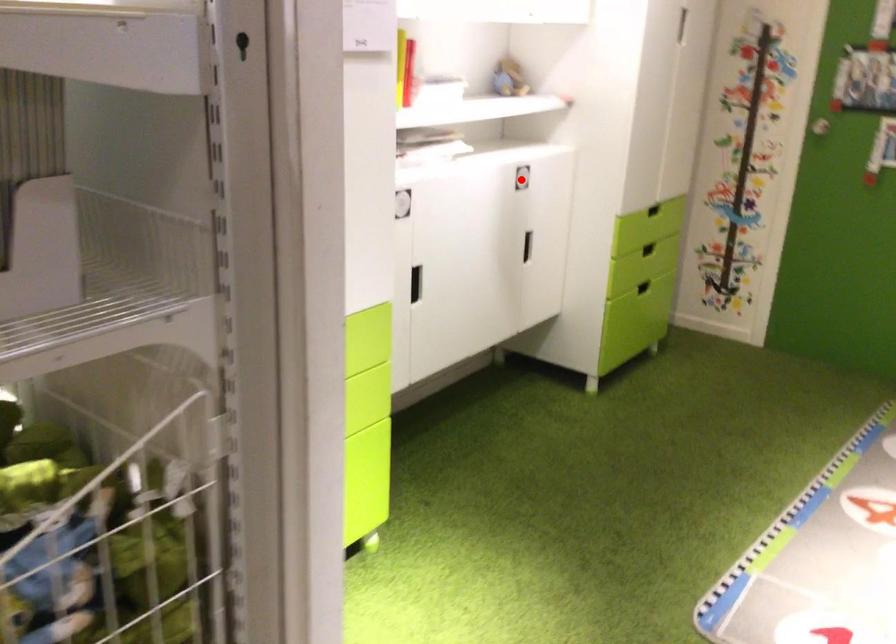
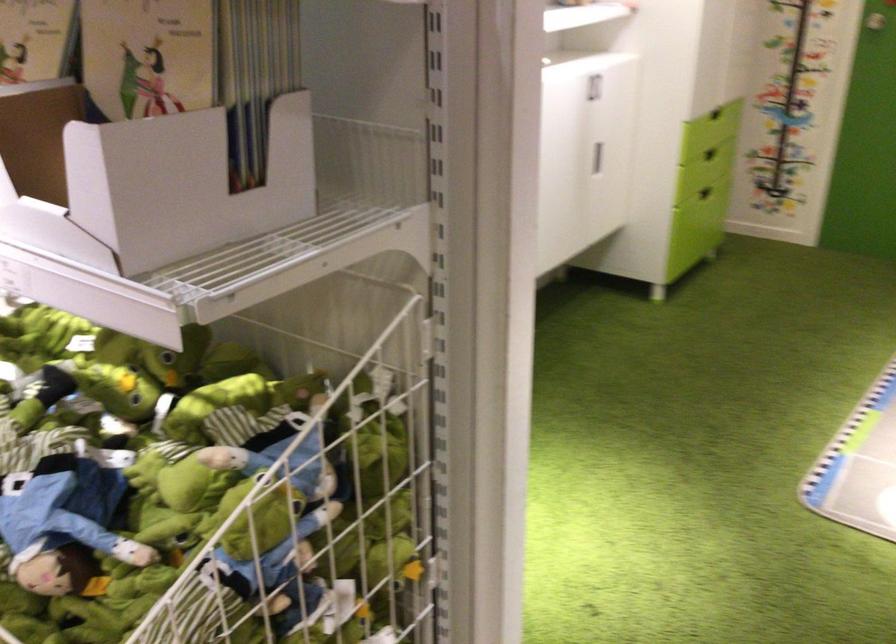
The point at the highlighted location is marked in the first image. Where is the corresponding point in the second image?

(593, 87)